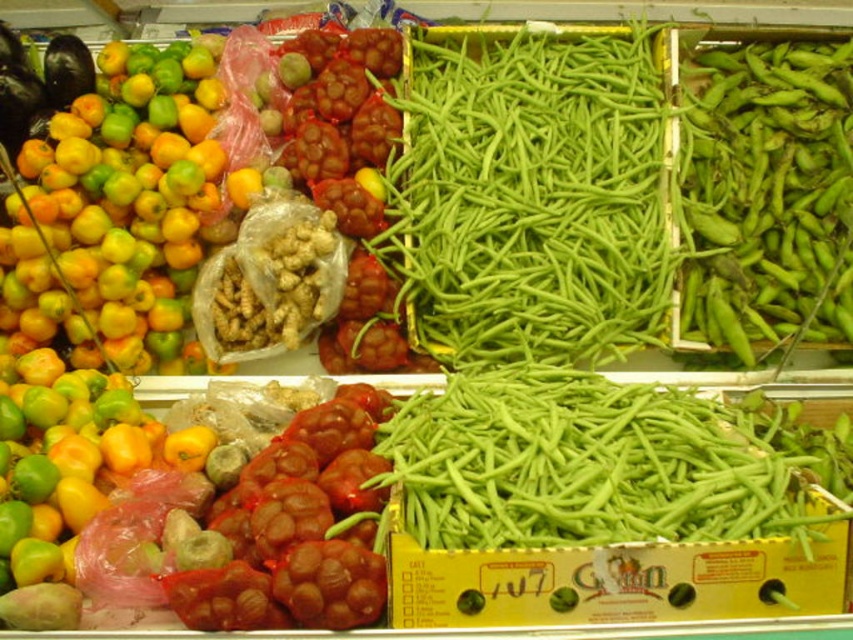
Is the position of green smooth beans at center less distant than that of green matte pod at upper right?

That is True.

What do you see at coordinates (529, 195) in the screenshot? I see `green smooth beans at center` at bounding box center [529, 195].

Where is `green smooth beans at center`? green smooth beans at center is located at coordinates (529, 195).